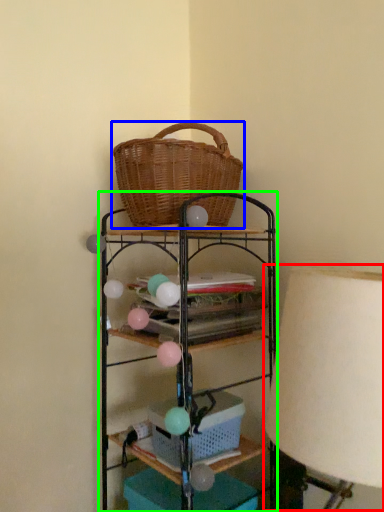
Question: Considering the real-world distances, which object is farthest from table lamp (highlighted by a red box)? picnic basket (highlighted by a blue box) or shelf (highlighted by a green box)?

Choices:
 (A) picnic basket
 (B) shelf

Answer: (A)